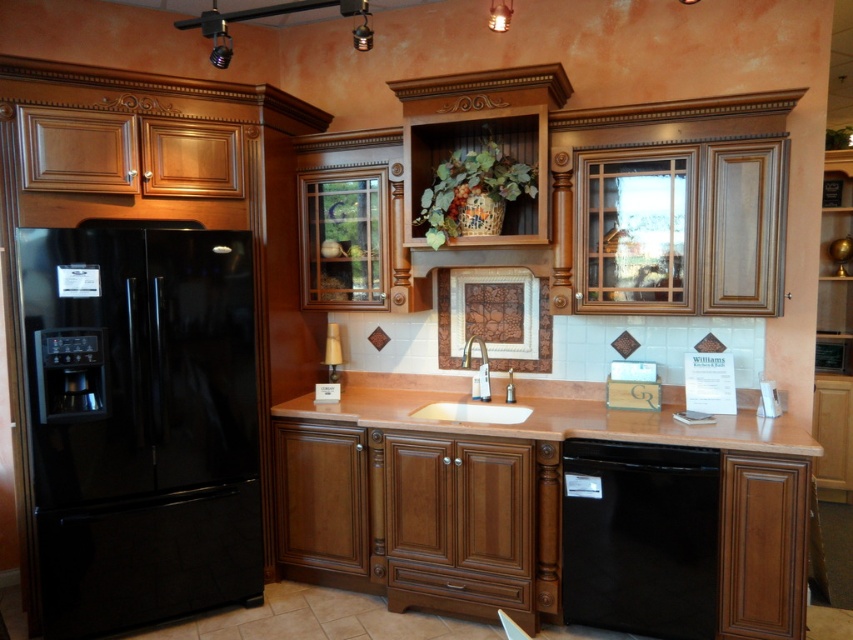
Question: Based on their relative distances, which object is farther from the brown polished countertop at center?

Choices:
 (A) black matte dishwasher at lower center
 (B) white ceramic sink at center
 (C) black glossy refrigerator at left
 (D) matte brown countertop at center

Answer: (C)

Question: Is the position of black glossy refrigerator at left less distant than that of white ceramic sink at center?

Choices:
 (A) yes
 (B) no

Answer: (A)

Question: Is black matte dishwasher at lower center positioned at the back of brown polished countertop at center?

Choices:
 (A) yes
 (B) no

Answer: (A)

Question: Which object appears closest to the camera in this image?

Choices:
 (A) black glossy refrigerator at left
 (B) matte brown countertop at center
 (C) black matte dishwasher at lower center
 (D) brown polished countertop at center

Answer: (D)

Question: Which object is the closest to the white ceramic sink at center?

Choices:
 (A) matte brown countertop at center
 (B) brown polished countertop at center
 (C) black matte dishwasher at lower center
 (D) black glossy refrigerator at left

Answer: (B)

Question: Observing the image, what is the correct spatial positioning of brown polished countertop at center in reference to white ceramic sink at center?

Choices:
 (A) left
 (B) right

Answer: (B)